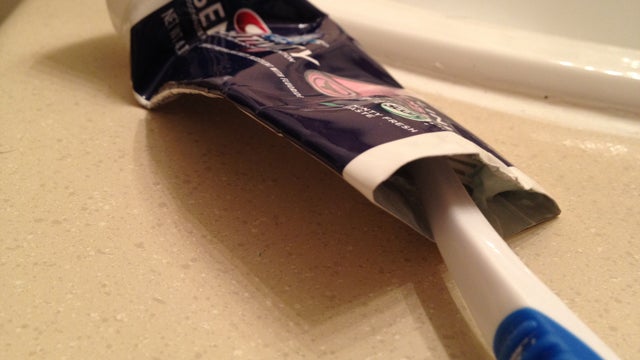
Identify the location of countertop. (40, 252).